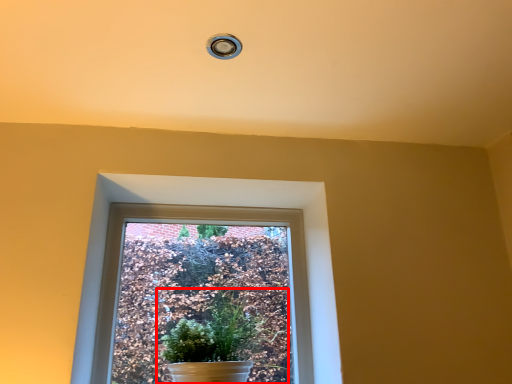
Question: Considering the relative positions of houseplant (annotated by the red box) and window in the image provided, where is houseplant (annotated by the red box) located with respect to the staircase?

Choices:
 (A) right
 (B) left

Answer: (A)